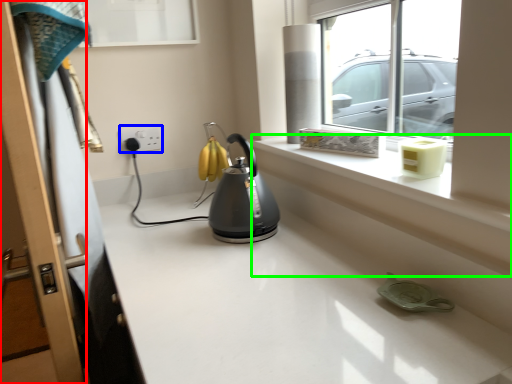
Question: Estimate the real-world distances between objects in this image. Which object is farther from screen door (highlighted by a red box), electric outlet (highlighted by a blue box) or ledge (highlighted by a green box)?

Choices:
 (A) electric outlet
 (B) ledge

Answer: (A)